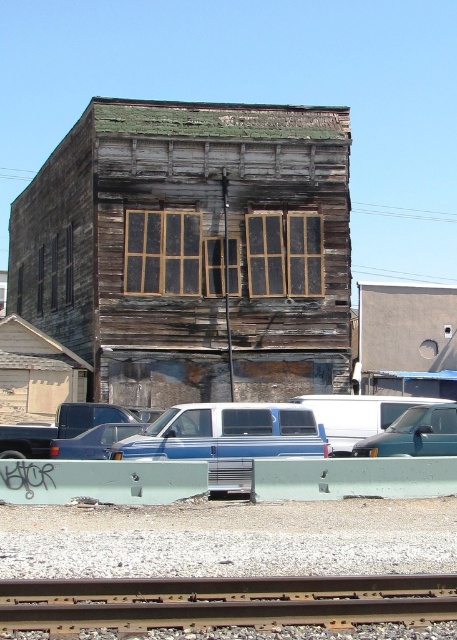
Question: Which point is farther from the camera taking this photo?

Choices:
 (A) (309, 620)
 (B) (73, 410)
 (C) (373, 444)
 (D) (65, 452)

Answer: (B)

Question: Can you confirm if blue metallic van at center is thinner than blue matte van at center?

Choices:
 (A) no
 (B) yes

Answer: (A)

Question: Is brown metal train track at bottom behind blue matte van at center?

Choices:
 (A) no
 (B) yes

Answer: (A)

Question: Which point is farther to the camera?

Choices:
 (A) (128, 616)
 (B) (137, 419)
 (C) (446, 448)
 (D) (223, 467)

Answer: (B)

Question: Which point is closer to the camera?

Choices:
 (A) (382, 452)
 (B) (128, 410)
 (C) (366, 609)
 (D) (260, 444)

Answer: (C)

Question: Is brown metal train track at bottom thinner than blue metallic van at center?

Choices:
 (A) yes
 (B) no

Answer: (B)